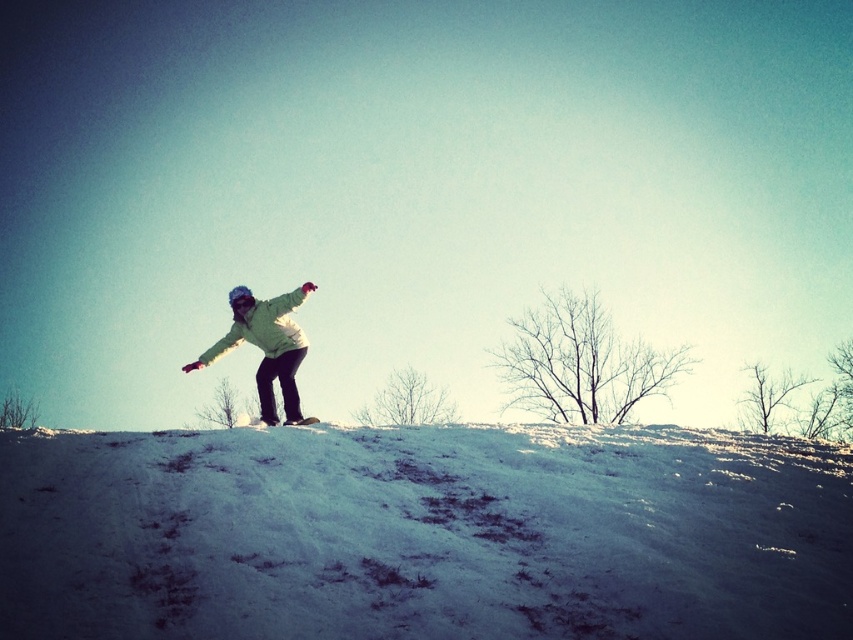
Question: Estimate the real-world distances between objects in this image. Which object is farther from the white matte snowboard at center?

Choices:
 (A) light green fabric snowboarder at center
 (B) white powdery snow at center

Answer: (B)

Question: Does white powdery snow at center appear on the left side of light green fabric snowboarder at center?

Choices:
 (A) no
 (B) yes

Answer: (A)

Question: Does light green fabric snowboarder at center appear under white matte snowboard at center?

Choices:
 (A) yes
 (B) no

Answer: (B)

Question: Considering the real-world distances, which object is closest to the white powdery snow at center?

Choices:
 (A) white matte snowboard at center
 (B) light green fabric snowboarder at center

Answer: (B)

Question: Is light green fabric snowboarder at center thinner than white matte snowboard at center?

Choices:
 (A) no
 (B) yes

Answer: (B)

Question: Among these points, which one is farthest from the camera?

Choices:
 (A) click(308, 417)
 (B) click(285, 332)

Answer: (B)